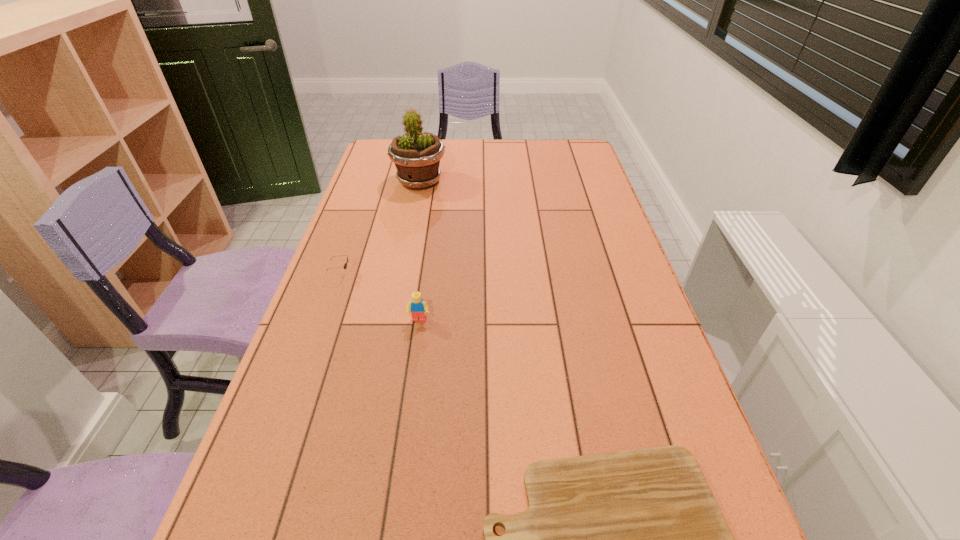
Identify the location of the second closest object relative to the farthest object. The width and height of the screenshot is (960, 540). (418, 307).

Identify which object is the nearest to the third farthest object. Please provide its 2D coordinates. Your answer should be formatted as a tuple, i.e. [(x, y)], where the tuple contains the x and y coordinates of a point satisfying the conditions above.

[(345, 265)]